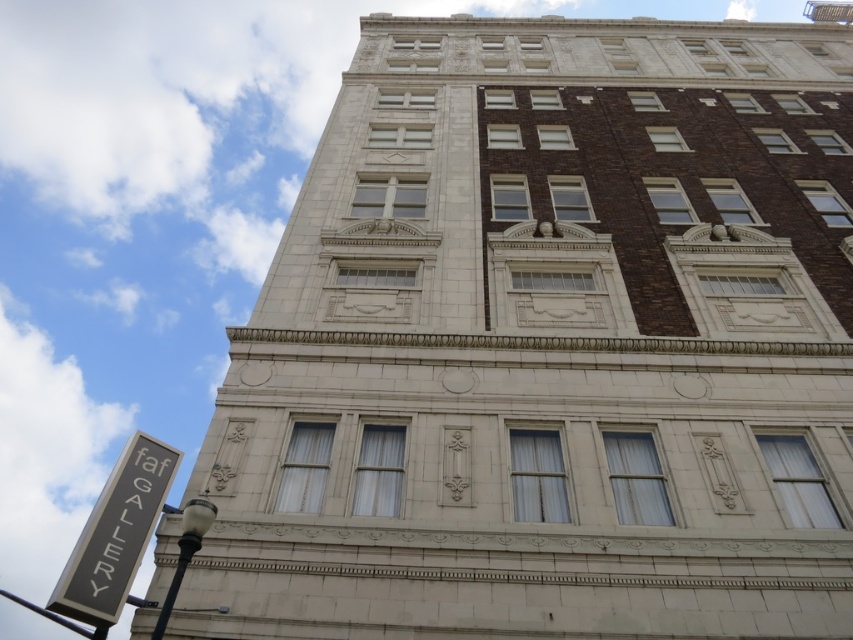
Question: Where is black metal sign at lower left located in relation to black metal pole at lower left in the image?

Choices:
 (A) below
 (B) above

Answer: (B)

Question: Does black metal sign at lower left appear under black metal pole at lower left?

Choices:
 (A) no
 (B) yes

Answer: (A)

Question: Is black metal sign at lower left thinner than black metal pole at lower left?

Choices:
 (A) no
 (B) yes

Answer: (B)

Question: Among these points, which one is farthest from the camera?

Choices:
 (A) (62, 605)
 (B) (20, 602)

Answer: (B)

Question: Which object is closer to the camera taking this photo?

Choices:
 (A) black metal pole at lower left
 (B) black metal sign at lower left

Answer: (A)

Question: Which of the following is the closest to the observer?

Choices:
 (A) (152, 499)
 (B) (84, 636)

Answer: (B)